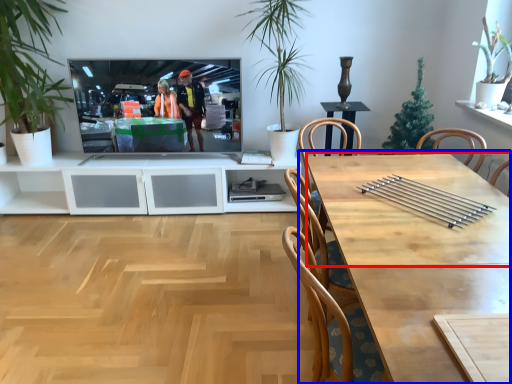
Question: Which object is closer to the camera taking this photo, counter top (highlighted by a red box) or table (highlighted by a blue box)?

Choices:
 (A) counter top
 (B) table

Answer: (B)